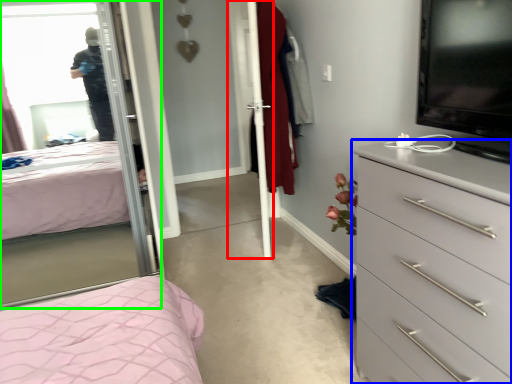
Question: Estimate the real-world distances between objects in this image. Which object is farther from screen door (highlighted by a red box), chest of drawers (highlighted by a blue box) or mirror (highlighted by a green box)?

Choices:
 (A) chest of drawers
 (B) mirror

Answer: (A)